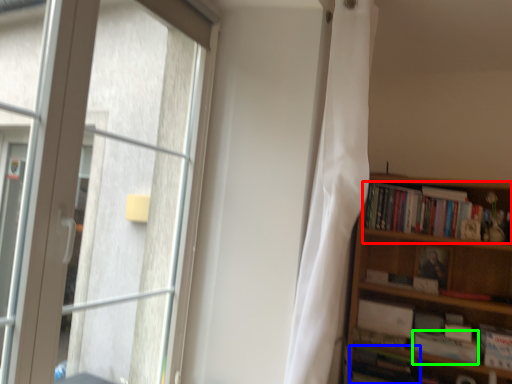
Question: Which is farther away from book (highlighted by a red box)? book (highlighted by a blue box) or paperback book (highlighted by a green box)?

Choices:
 (A) book
 (B) paperback book

Answer: (A)